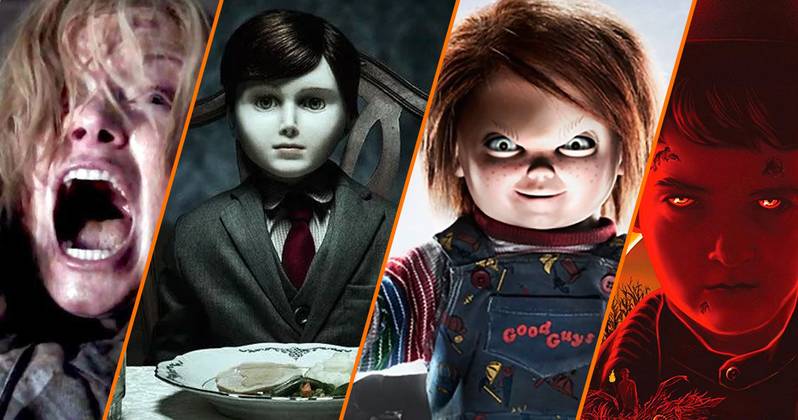
Find the location of `plate`. plate is located at coordinates (207, 358).